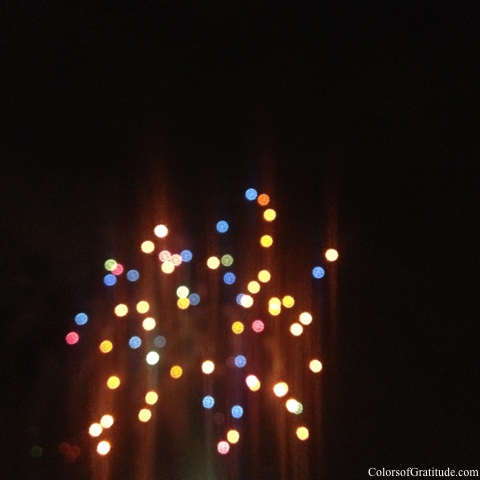
At what (x,y) coordinates should I click in order to perform the action: click on orange light. Please return your answer as a coordinate pair (x, y). Looking at the image, I should click on (263, 196).